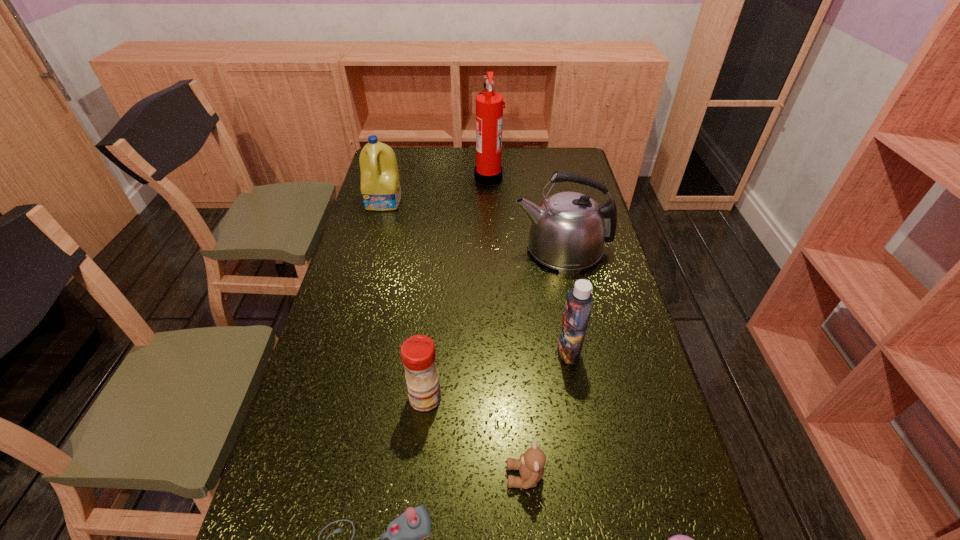
In order to click on free point located 0.130m with the nozzle aimed from the tallest object in this screenshot , I will do `click(444, 177)`.

You are a GUI agent. You are given a task and a screenshot of the screen. Output one action in this format:
    pyautogui.click(x=<x>, y=<y>)
    Task: Click on the vacant space located on the spout of the third farthest object
    The image size is (960, 540).
    Given the screenshot: What is the action you would take?
    pyautogui.click(x=490, y=248)

Where is `free space located 0.090m on the spout of the third farthest object`? free space located 0.090m on the spout of the third farthest object is located at coordinates coord(487,248).

This screenshot has width=960, height=540. I want to click on free region located on the spout of the third farthest object, so click(x=492, y=248).

Where is `vacant point located 0.270m on the label of the detergent`? Image resolution: width=960 pixels, height=540 pixels. vacant point located 0.270m on the label of the detergent is located at coordinates (369, 260).

The height and width of the screenshot is (540, 960). Find the location of `free space located 0.360m on the front label of the fifth nearest object`. free space located 0.360m on the front label of the fifth nearest object is located at coordinates (424, 351).

Locate an element on the screen. This screenshot has height=540, width=960. vacant space located on the front label of the fifth nearest object is located at coordinates (536, 351).

This screenshot has width=960, height=540. Identify the location of vacant region located 0.070m on the front label of the fifth nearest object. (532, 351).

Find the location of a particular element. This screenshot has height=540, width=960. vacant space situated on the left of the fourth nearest object is located at coordinates (365, 397).

Find the location of a particular element. vacant space situated 0.160m on the front-facing side of the sixth tallest object is located at coordinates (433, 476).